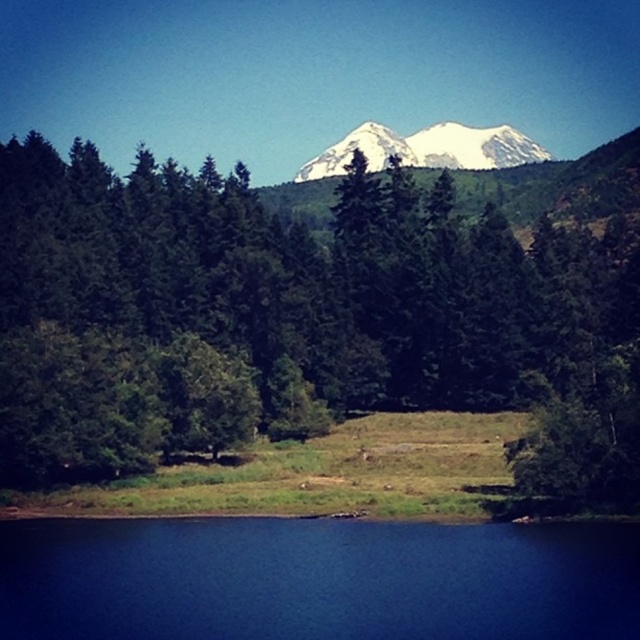
How far apart are blue liquid at lower center and snowy white mountain at upper center?

A distance of 181.84 meters exists between blue liquid at lower center and snowy white mountain at upper center.

Between blue liquid at lower center and snowy white mountain at upper center, which one has more height?

snowy white mountain at upper center is taller.

Is point (224, 609) behind point (550, 157)?

No, (224, 609) is closer to viewer.

Identify the location of blue liquid at lower center. The height and width of the screenshot is (640, 640). pyautogui.click(x=316, y=579).

What do you see at coordinates (317, 308) in the screenshot? I see `green matte tree at center` at bounding box center [317, 308].

Can you confirm if green matte tree at center is shorter than snowy white mountain at upper center?

In fact, green matte tree at center may be taller than snowy white mountain at upper center.

Does point (90, 300) lie in front of point (348, 157)?

That is True.

Locate an element on the screen. green matte tree at center is located at coordinates (317, 308).

Which is more to the right, green matte tree at center or blue liquid at lower center?

From the viewer's perspective, green matte tree at center appears more on the right side.

Is green matte tree at center to the left of blue liquid at lower center from the viewer's perspective?

Incorrect, green matte tree at center is not on the left side of blue liquid at lower center.

Image resolution: width=640 pixels, height=640 pixels. What do you see at coordinates (317, 308) in the screenshot? I see `green matte tree at center` at bounding box center [317, 308].

Where is `green matte tree at center`? The image size is (640, 640). green matte tree at center is located at coordinates (317, 308).